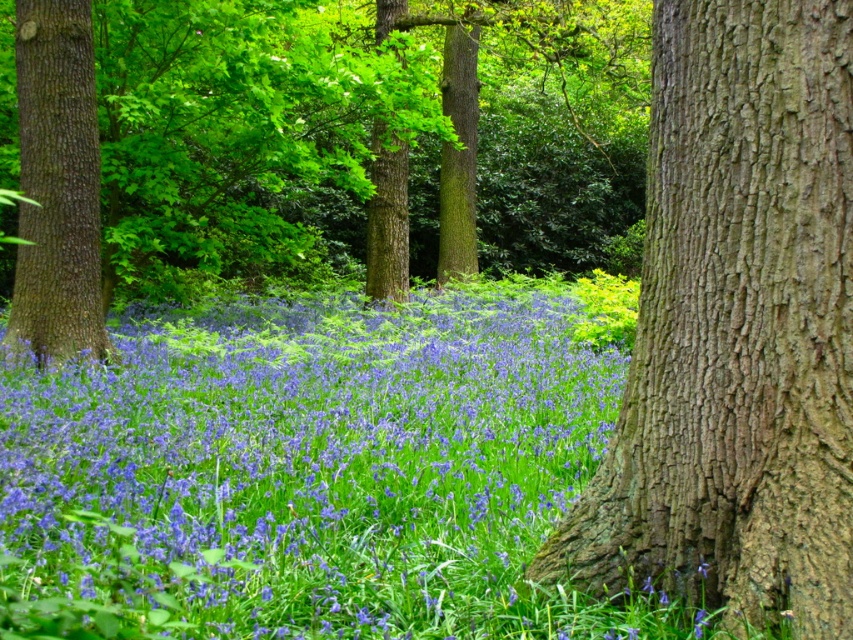
You are standing in the woodland scene and want to place a small marker at point coordinates (364,140). Based on the scene description, where exactly would this marker be placed?

The point coordinates (364,140) are on the smooth brown tree trunk at center, so the marker would be placed on the smooth brown tree trunk at center.

You are a botanist studying the woodland flora. You observe the blue matte flowers at center in this image. Based on their position, can you determine their exact coordinates in the scene?

The blue matte flowers at center are located at the 2D coordinates of point (321, 465).

You are standing in the woodland scene described. There is a point at coordinate (364, 140). What can be found at that exact point?

At point (364, 140) lies a smooth brown tree trunk at center.